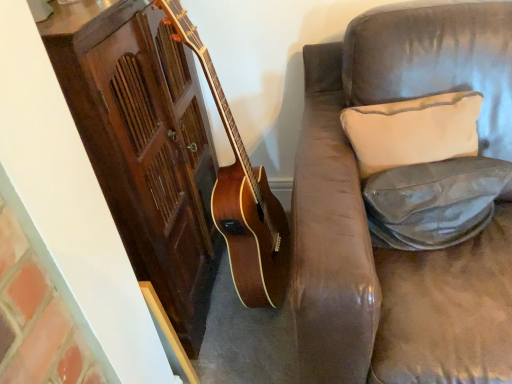
Question: Would you say white fabric pillow at upper right, which appears as the second pillow when ordered from the bottom, is to the left or to the right of leather-like gray pillow at right, the 2th pillow from the top, in the picture?

Choices:
 (A) right
 (B) left

Answer: (B)

Question: Considering their positions, is white fabric pillow at upper right, marked as the first pillow in a top-to-bottom arrangement, located in front of or behind leather-like gray pillow at right, the 2th pillow from the top?

Choices:
 (A) behind
 (B) front

Answer: (A)

Question: Is point (477, 92) positioned closer to the camera than point (381, 208)?

Choices:
 (A) farther
 (B) closer

Answer: (A)

Question: Considering the positions of leather-like gray pillow at right, the 2th pillow from the top, and white fabric pillow at upper right, marked as the first pillow in a top-to-bottom arrangement, in the image, is leather-like gray pillow at right, the 2th pillow from the top, wider or thinner than white fabric pillow at upper right, marked as the first pillow in a top-to-bottom arrangement,?

Choices:
 (A) thin
 (B) wide

Answer: (A)

Question: In terms of height, does leather-like gray pillow at right, the 2th pillow from the top, look taller or shorter compared to white fabric pillow at upper right, which appears as the second pillow when ordered from the bottom?

Choices:
 (A) short
 (B) tall

Answer: (A)

Question: Is leather-like gray pillow at right, marked as the 1th pillow in a bottom-to-top arrangement, in front of or behind white fabric pillow at upper right, which appears as the second pillow when ordered from the bottom, in the image?

Choices:
 (A) front
 (B) behind

Answer: (A)

Question: Would you say leather-like gray pillow at right, marked as the 1th pillow in a bottom-to-top arrangement, is inside or outside white fabric pillow at upper right, marked as the first pillow in a top-to-bottom arrangement?

Choices:
 (A) outside
 (B) inside

Answer: (A)